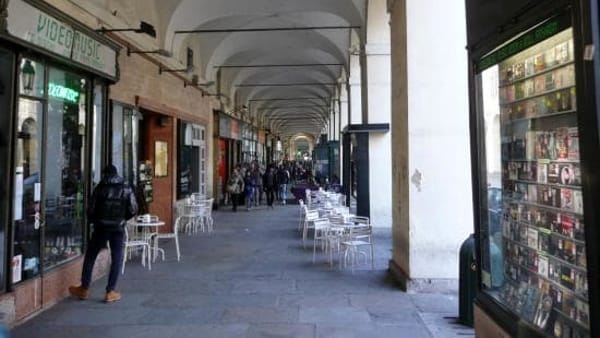
At what (x,y) coordinates should I click in order to perform the action: click on column. Please return your answer as a coordinate pair (x, y). The width and height of the screenshot is (600, 338). Looking at the image, I should click on (454, 138), (391, 81), (355, 100), (343, 108), (334, 123), (327, 127).